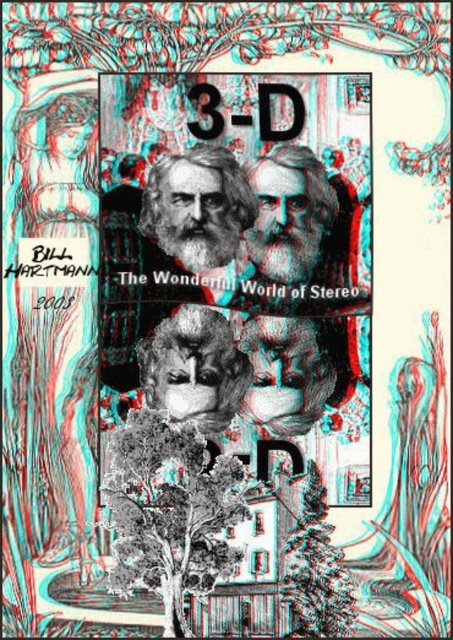
Question: Can you confirm if green leafy tree at lower center is thinner than gray beard at center?

Choices:
 (A) no
 (B) yes

Answer: (A)

Question: Which object is positioned closest to the gray beard at center?

Choices:
 (A) green matte tree at lower center
 (B) green leafy tree at lower center

Answer: (B)

Question: Which object is positioned farthest from the white beard at center?

Choices:
 (A) gray beard at center
 (B) green matte tree at lower center

Answer: (B)

Question: Among these objects, which one is farthest from the camera?

Choices:
 (A) gray beard at center
 (B) white beard at center
 (C) green matte tree at lower center

Answer: (B)

Question: Does white beard at center have a greater width compared to gray beard at center?

Choices:
 (A) no
 (B) yes

Answer: (A)

Question: Does green leafy tree at lower center appear under white beard at center?

Choices:
 (A) no
 (B) yes

Answer: (B)